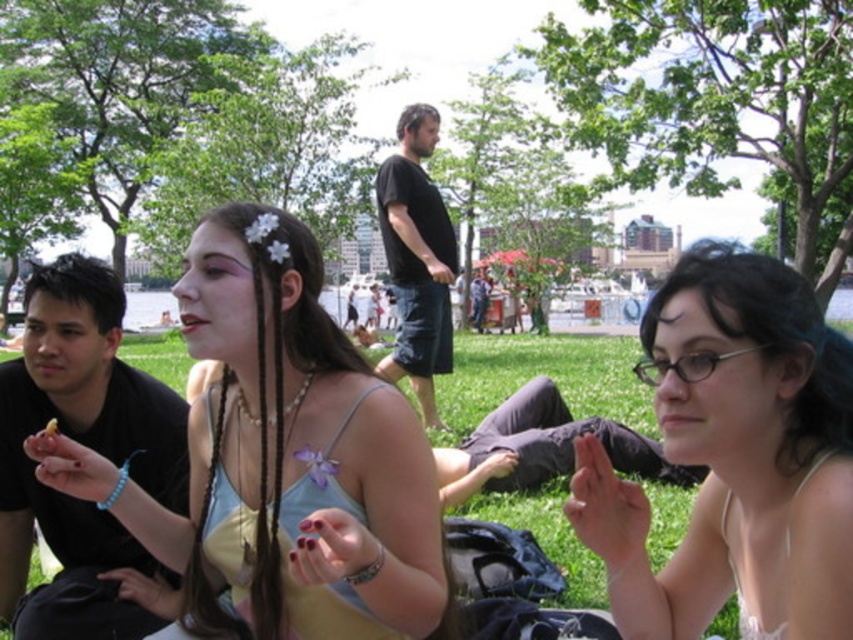
You are a photographer trying to capture a closeup of the matte yellow tank top at center and the green grass at center. Which object will appear smaller in the photo?

The matte yellow tank top at center will appear smaller in the photo because it is thinner than the green grass at center.

Consider the image. You are a photographer standing at the edge of the park, wanting to capture a photo of the matte yellow tank top at center and the black matte shirt at left without any obstructions. Given that your camera has a maximum zoom range of 10 meters, will you be able to take the photo clearly?

The distance between the matte yellow tank top at center and the black matte shirt at left is 8.28 meters, which is within the camera maximum zoom range of 10 meters. Therefore, you can take the photo clearly.